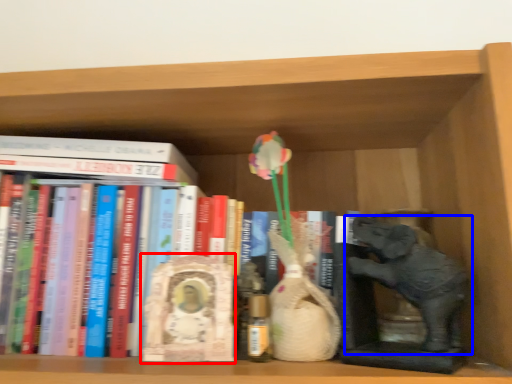
Question: Among these objects, which one is nearest to the camera, sculpture (highlighted by a red box) or elephant (highlighted by a blue box)?

Choices:
 (A) sculpture
 (B) elephant

Answer: (B)